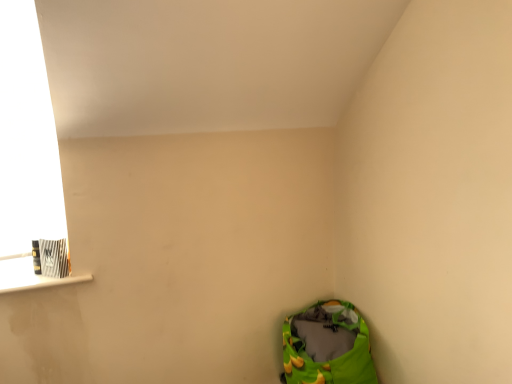
You are a GUI agent. You are given a task and a screenshot of the screen. Output one action in this format:
    pyautogui.click(x=<x>, y=<y>)
    Task: Click on the green fabric shoulder bag at lower right
    
    Given the screenshot: What is the action you would take?
    pyautogui.click(x=327, y=346)

What do you see at coordinates (327, 346) in the screenshot? I see `green fabric shoulder bag at lower right` at bounding box center [327, 346].

Find the location of a particular element. This screenshot has height=384, width=512. green fabric shoulder bag at lower right is located at coordinates (327, 346).